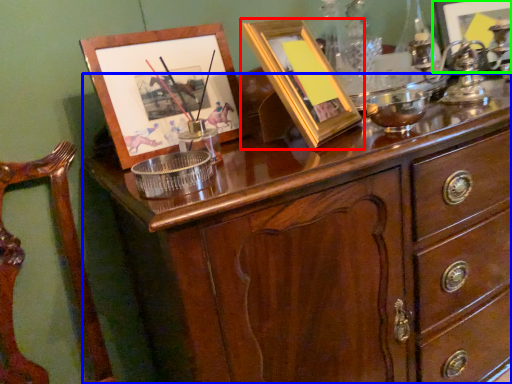
Question: Estimate the real-world distances between objects in this image. Which object is farther from picture frame (highlighted by a red box), chest of drawers (highlighted by a blue box) or picture frame (highlighted by a green box)?

Choices:
 (A) chest of drawers
 (B) picture frame

Answer: (B)